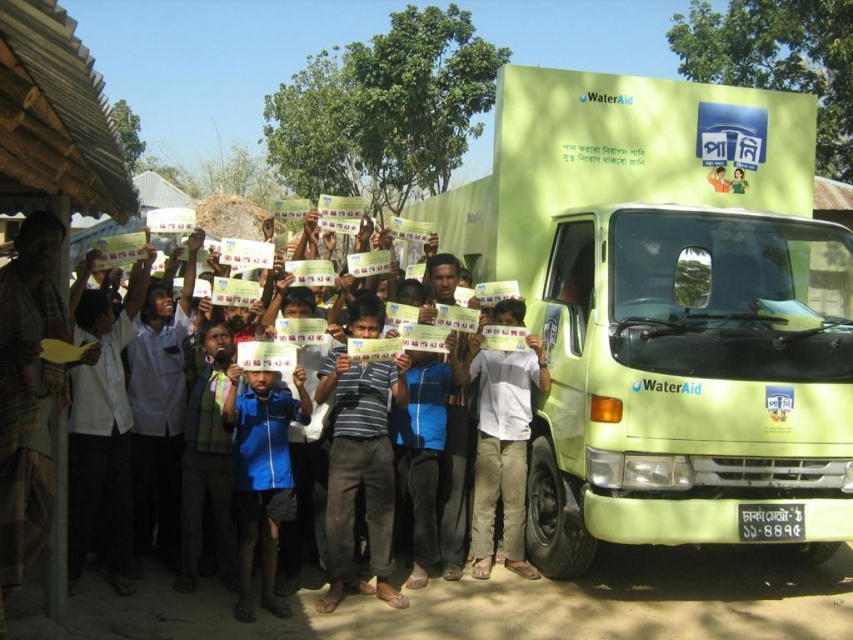
Question: Which point is farther from the camera taking this photo?

Choices:
 (A) (244, 592)
 (B) (514, 566)
 (C) (534, 163)

Answer: (C)

Question: In this image, where is light blue shirt at center located relative to blue fabric shirt at center?

Choices:
 (A) above
 (B) below

Answer: (A)

Question: Is light blue shirt at center above blue fabric shirt at center?

Choices:
 (A) yes
 (B) no

Answer: (A)

Question: Does green matte truck at center come in front of blue fabric shirt at center?

Choices:
 (A) no
 (B) yes

Answer: (B)

Question: Which point is closer to the camera taking this photo?

Choices:
 (A) (569, 518)
 (B) (282, 506)
 (C) (498, 360)

Answer: (B)

Question: Which point is farther to the camera?

Choices:
 (A) blue fabric shirt at center
 (B) light blue shirt at center

Answer: (B)